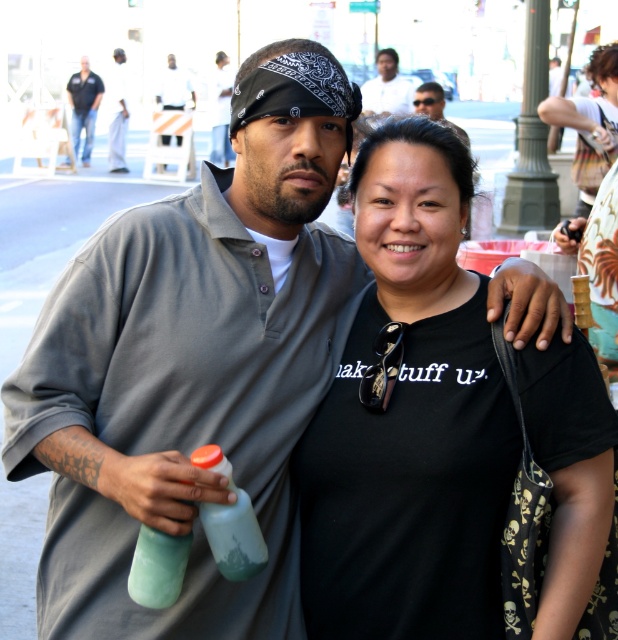
You are a photographer trying to capture a group photo of the two people in the image. Since you want to ensure that everyone is visible, you need to adjust the camera angle so that the white cotton shirt at upper center and the matte gray shirt at center are both fully in frame. Which shirt should you focus on first to ensure proper framing?

The white cotton shirt at upper center is taller than the matte gray shirt at center, so you should focus on framing the white cotton shirt at upper center first to ensure the entire height of both shirts is captured.

You are a photographer trying to capture a photo of the green translucent bottle at center and the smooth white shirt at upper center. The camera you are using has a maximum focus range of 6 meters. Will both objects be in focus if you take the photo now?

The green translucent bottle at center and the smooth white shirt at upper center are 6.72 meters apart from each other. Since the camera can only focus up to 6 meters, the distance between them exceeds the focus range. Therefore, both objects cannot be in focus simultaneously.

You are a photographer standing 10 feet away from the green translucent bottle at center and the matte gray shirt at center. You want to take a photo that includes both objects in the frame. Based on their distance apart, will you need to zoom in or zoom out to ensure both are fully visible?

The green translucent bottle at center and the matte gray shirt at center are 59.56 feet apart. Since you are standing 10 feet away from both objects, the distance between them is much larger than your distance from them. To fit both into the frame, you will need to zoom out.